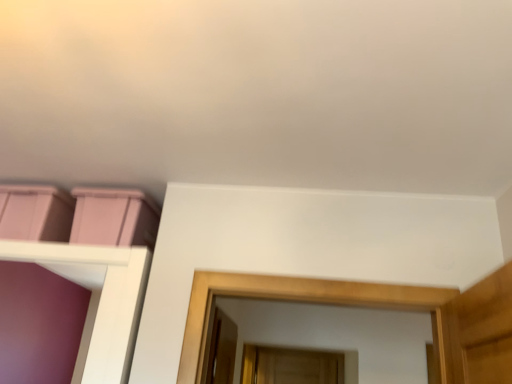
The height and width of the screenshot is (384, 512). I want to click on matte pink plastic lift at upper left, so click(x=35, y=212).

What do you see at coordinates (35, 212) in the screenshot? I see `matte pink plastic lift at upper left` at bounding box center [35, 212].

The image size is (512, 384). Identify the location of matte pink plastic lift at upper left. (35, 212).